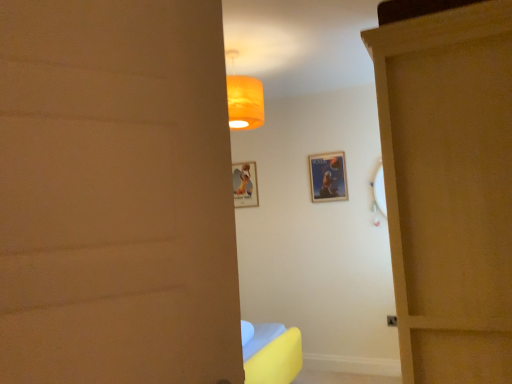
Question: From the image's perspective, would you say wooden door at right is positioned over matte paper picture frame at center, which is counted as the first picture frame, starting from the left?

Choices:
 (A) yes
 (B) no

Answer: (B)

Question: Does wooden door at right have a smaller size compared to matte paper picture frame at center, acting as the 1th picture frame starting from the back?

Choices:
 (A) no
 (B) yes

Answer: (A)

Question: Is the position of wooden door at right less distant than that of matte paper picture frame at center, which is counted as the second picture frame, starting from the right?

Choices:
 (A) yes
 (B) no

Answer: (A)

Question: From a real-world perspective, is wooden door at right located beneath matte paper picture frame at center, acting as the 1th picture frame starting from the back?

Choices:
 (A) no
 (B) yes

Answer: (B)

Question: Is wooden door at right beside matte paper picture frame at center, which appears as the 2th picture frame when viewed from the front?

Choices:
 (A) yes
 (B) no

Answer: (B)

Question: In terms of height, does matte paper picture frame at center, which appears as the 2th picture frame when viewed from the front, look taller or shorter compared to wooden door at right?

Choices:
 (A) tall
 (B) short

Answer: (B)

Question: Is matte paper picture frame at center, acting as the 1th picture frame starting from the back, in front of or behind wooden door at right in the image?

Choices:
 (A) behind
 (B) front

Answer: (A)

Question: Is point coord(249,183) positioned closer to the camera than point coord(379,34)?

Choices:
 (A) closer
 (B) farther

Answer: (B)

Question: From a real-world perspective, is matte paper picture frame at center, which is counted as the second picture frame, starting from the right, physically located above or below wooden door at right?

Choices:
 (A) above
 (B) below

Answer: (A)

Question: Considering the positions of matte paper picture frame at center, which is counted as the first picture frame, starting from the left, and metallic silver poster at center, marked as the first picture frame in a right-to-left arrangement, in the image, is matte paper picture frame at center, which is counted as the first picture frame, starting from the left, taller or shorter than metallic silver poster at center, marked as the first picture frame in a right-to-left arrangement,?

Choices:
 (A) tall
 (B) short

Answer: (A)

Question: In the image, is matte paper picture frame at center, which is counted as the second picture frame, starting from the right, on the left side or the right side of metallic silver poster at center, positioned as the 1th picture frame in front-to-back order?

Choices:
 (A) right
 (B) left

Answer: (B)

Question: From a real-world perspective, is matte paper picture frame at center, which is counted as the first picture frame, starting from the left, positioned above or below metallic silver poster at center, marked as the first picture frame in a right-to-left arrangement?

Choices:
 (A) below
 (B) above

Answer: (B)

Question: Is matte paper picture frame at center, which appears as the 2th picture frame when viewed from the front, situated inside metallic silver poster at center, positioned as the 1th picture frame in front-to-back order, or outside?

Choices:
 (A) outside
 (B) inside

Answer: (A)

Question: In the image, is metallic silver poster at center, marked as the first picture frame in a right-to-left arrangement, positioned in front of or behind wooden door at right?

Choices:
 (A) behind
 (B) front

Answer: (A)

Question: Considering the relative positions of metallic silver poster at center, which appears as the 2th picture frame when viewed from the back, and wooden door at right in the image provided, is metallic silver poster at center, which appears as the 2th picture frame when viewed from the back, to the left or to the right of wooden door at right?

Choices:
 (A) right
 (B) left

Answer: (B)